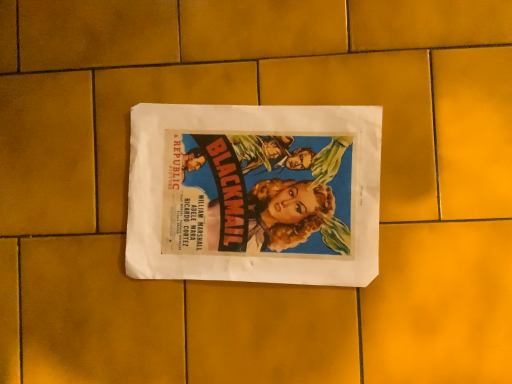
At what (x,y) coordinates should I click in order to perform the action: click on free point above matte paper poster at center (from a real-world perspective). Please return your answer as a coordinate pair (x, y). The image size is (512, 384). Looking at the image, I should click on pyautogui.click(x=250, y=192).